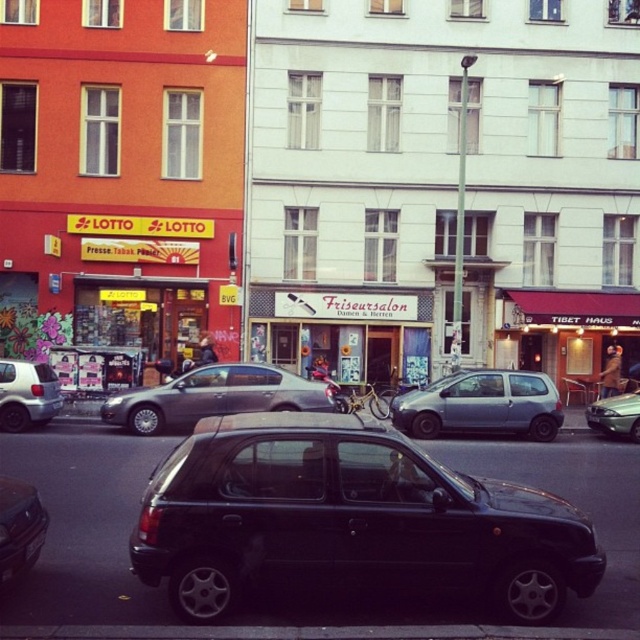
Does shiny black car at lower left come in front of white matte hatchback at left?

That is True.

Between point (13, 497) and point (6, 428), which one is positioned in front?

Point (13, 497)

Identify the location of shiny black car at lower left. (19, 529).

Who is positioned more to the left, silver metallic sedan at center or metallic silver sedan at center?

silver metallic sedan at center

What do you see at coordinates (214, 396) in the screenshot? The image size is (640, 640). I see `silver metallic sedan at center` at bounding box center [214, 396].

Who is more distant from viewer, (236, 396) or (612, 397)?

The point (612, 397) is more distant.

Identify the location of silver metallic sedan at center. (214, 396).

Who is lower down, silver metallic sedan at center or shiny black car at lower left?

shiny black car at lower left is below.

Consider the image. Can you confirm if silver metallic sedan at center is shorter than shiny black car at lower left?

No.

The height and width of the screenshot is (640, 640). What are the coordinates of `silver metallic sedan at center` in the screenshot? It's located at (214, 396).